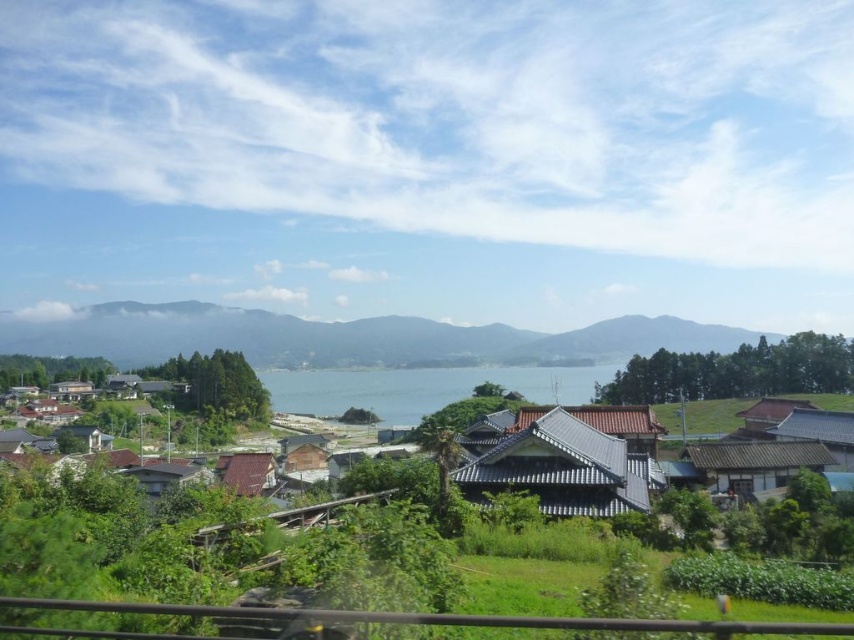
Does green grassy hillside at center lie behind brown tiled roofs at center?

Yes, it is behind brown tiled roofs at center.

Who is more distant from viewer, (361, 332) or (355, 433)?

Point (361, 332)

Identify the location of green grassy hillside at center. (343, 337).

Can you confirm if brown tile roof hut at lower right is smaller than brown tile roof at lower left?

Yes.

Is point (746, 481) behind point (252, 474)?

No, it is in front of (252, 474).

Which is behind, point (705, 472) or point (262, 460)?

Positioned behind is point (262, 460).

At what (x,y) coordinates should I click in order to perform the action: click on brown tile roof hut at lower right. Please return your answer as a coordinate pair (x, y). Looking at the image, I should click on (753, 465).

Is green grassy hillside at center wider than brown tile roof at lower left?

Indeed, green grassy hillside at center has a greater width compared to brown tile roof at lower left.

Who is shorter, green grassy hillside at center or brown tile roof at lower left?

brown tile roof at lower left is shorter.

Find the location of a particular element. This screenshot has width=854, height=640. green grassy hillside at center is located at coordinates click(343, 337).

Locate an element on the screen. Image resolution: width=854 pixels, height=640 pixels. green grassy hillside at center is located at coordinates (343, 337).